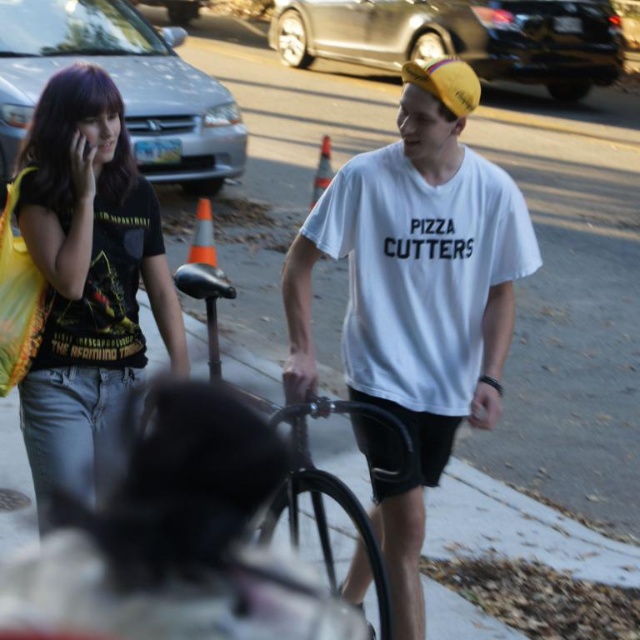
Question: Which object is farther from the camera taking this photo?

Choices:
 (A) black matte bicycle at center
 (B) white cotton t-shirt at center

Answer: (B)

Question: Among these points, which one is nearest to the camera?

Choices:
 (A) (68, 440)
 (B) (417, 218)
 (C) (294, 428)

Answer: (C)

Question: Does matte black t-shirt at left come behind black matte bicycle at center?

Choices:
 (A) no
 (B) yes

Answer: (B)

Question: Among these objects, which one is nearest to the camera?

Choices:
 (A) white cotton t-shirt at center
 (B) black matte bicycle at center

Answer: (B)

Question: Considering the relative positions of white cotton t-shirt at center and black matte bicycle at center in the image provided, where is white cotton t-shirt at center located with respect to black matte bicycle at center?

Choices:
 (A) below
 (B) above

Answer: (B)

Question: Does white cotton t-shirt at center have a greater width compared to matte black t-shirt at left?

Choices:
 (A) no
 (B) yes

Answer: (B)